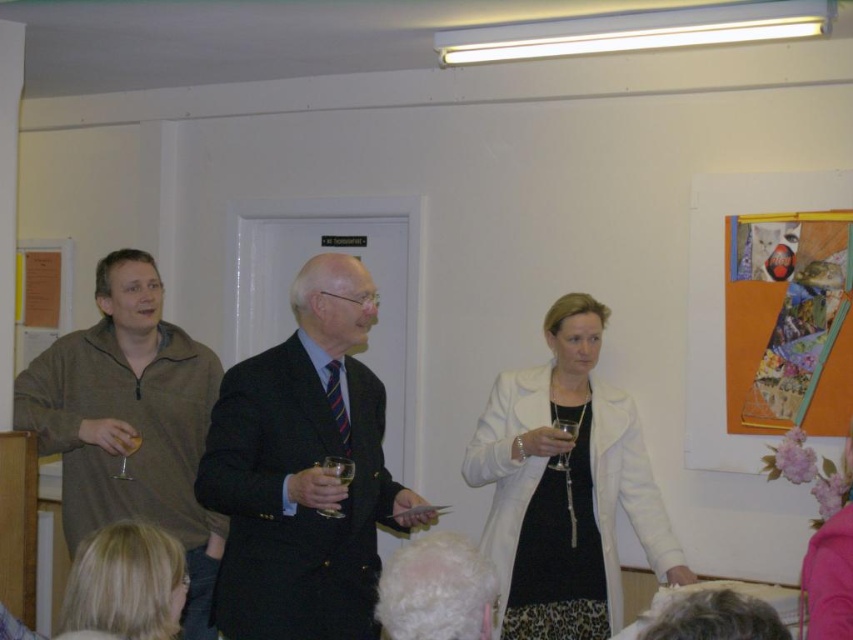
Question: Which point is farther to the camera?

Choices:
 (A) dark suit at center
 (B) transparent glass at center
 (C) white matte coat at center

Answer: (C)

Question: From the image, what is the correct spatial relationship of white matte coat at center in relation to matte brown sweater at left?

Choices:
 (A) below
 (B) above

Answer: (A)

Question: Which point is closer to the camera?

Choices:
 (A) blonde hair at lower left
 (B) dark suit at center
 (C) matte brown sweater at left
 (D) floral fabric at lower right

Answer: (A)

Question: Is blonde hair at lower left thinner than clear glass wine at left?

Choices:
 (A) no
 (B) yes

Answer: (A)

Question: Considering the real-world distances, which object is farthest from the white matte coat at center?

Choices:
 (A) blonde hair at lower left
 (B) transparent glass at center

Answer: (A)

Question: Is white matte coat at center to the left of matte brown sweater at left from the viewer's perspective?

Choices:
 (A) no
 (B) yes

Answer: (A)